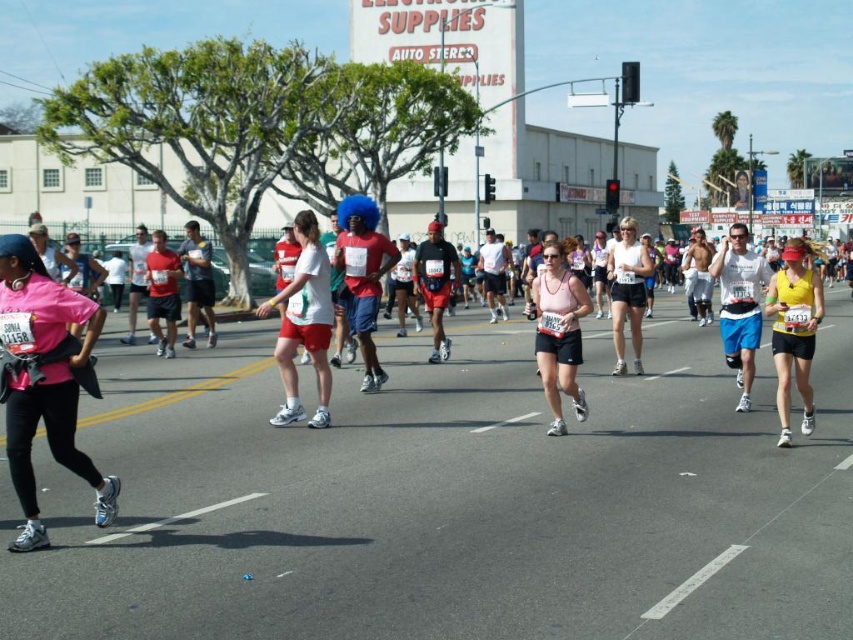
You are a photographer positioned at the side of the marathon route. You notice two items worn by a runner at the center of your viewfinder. The items are the yellow matte tank top at center and the pink fabric shorts at center. Which of these items appears smaller in your camera frame?

The yellow matte tank top at center appears smaller than the pink fabric shorts at center in the camera frame.

You are a photographer positioned at the starting line of the marathon. You want to capture a photo of the runner wearing the yellow matte tank top at center and the pink fabric shorts at center. Which piece of clothing will appear larger in your photo?

The yellow matte tank top at center will appear larger in the photo because it is closer to the viewer than the pink fabric shorts at center.

You are a photographer positioned at the starting line of the marathon. You need to capture a photo that includes both the pink matte shirt at left and the white matte shorts at center. Which object should you focus on first to ensure both are in the frame?

The pink matte shirt at left is shorter than the white matte shorts at center, so you should focus on the white matte shorts at center first to ensure both are in the frame.